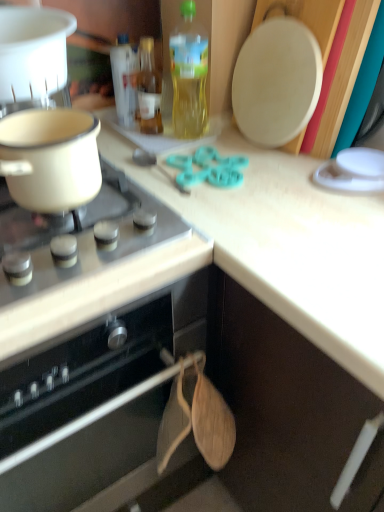
Question: Does white glossy gas stove at upper left have a greater height compared to white plastic pot at upper left, which is the second kitchen appliance from bottom to top?

Choices:
 (A) no
 (B) yes

Answer: (A)

Question: Are white glossy gas stove at upper left and white plastic pot at upper left, which is the second kitchen appliance from bottom to top, making contact?

Choices:
 (A) no
 (B) yes

Answer: (A)

Question: Is white glossy gas stove at upper left oriented away from white plastic pot at upper left, the 1th kitchen appliance when ordered from top to bottom?

Choices:
 (A) yes
 (B) no

Answer: (B)

Question: Would you say white glossy gas stove at upper left is outside white plastic pot at upper left, the 1th kitchen appliance when ordered from top to bottom?

Choices:
 (A) no
 (B) yes

Answer: (B)

Question: Can you confirm if white glossy gas stove at upper left is thinner than white plastic pot at upper left, the 1th kitchen appliance when ordered from top to bottom?

Choices:
 (A) yes
 (B) no

Answer: (B)

Question: In the image, is translucent yellow bottle at upper center, the first bottle in the right-to-left sequence, on the left side or the right side of white glossy gas stove at upper left?

Choices:
 (A) right
 (B) left

Answer: (A)

Question: Considering their positions, is translucent yellow bottle at upper center, the first bottle in the right-to-left sequence, located in front of or behind white glossy gas stove at upper left?

Choices:
 (A) front
 (B) behind

Answer: (B)

Question: Does point (205, 128) appear closer or farther from the camera than point (122, 232)?

Choices:
 (A) closer
 (B) farther

Answer: (B)

Question: Is translucent yellow bottle at upper center, the third bottle viewed from the left, inside or outside of white glossy gas stove at upper left?

Choices:
 (A) outside
 (B) inside

Answer: (A)

Question: In terms of width, does matte white pot at left, acting as the 1th kitchen appliance starting from the bottom, look wider or thinner when compared to translucent plastic bottle at upper center, the 1th bottle positioned from the left?

Choices:
 (A) wide
 (B) thin

Answer: (A)

Question: Visually, is matte white pot at left, which is the 2th kitchen appliance in top-to-bottom order, positioned to the left or to the right of translucent plastic bottle at upper center, the 1th bottle positioned from the left?

Choices:
 (A) right
 (B) left

Answer: (B)

Question: From a real-world perspective, is matte white pot at left, which is the 2th kitchen appliance in top-to-bottom order, physically located above or below translucent plastic bottle at upper center, positioned as the third bottle in right-to-left order?

Choices:
 (A) below
 (B) above

Answer: (B)

Question: Considering their positions, is matte white pot at left, which is the 2th kitchen appliance in top-to-bottom order, located in front of or behind translucent plastic bottle at upper center, positioned as the third bottle in right-to-left order?

Choices:
 (A) behind
 (B) front

Answer: (B)

Question: From the image's perspective, is white plastic pot at upper left, the 1th kitchen appliance when ordered from top to bottom, located above or below translucent glass bottle at upper center, the second bottle in the right-to-left sequence?

Choices:
 (A) below
 (B) above

Answer: (B)

Question: Relative to translucent glass bottle at upper center, which ranks as the second bottle in left-to-right order, is white plastic pot at upper left, the 1th kitchen appliance when ordered from top to bottom, in front or behind?

Choices:
 (A) behind
 (B) front

Answer: (B)